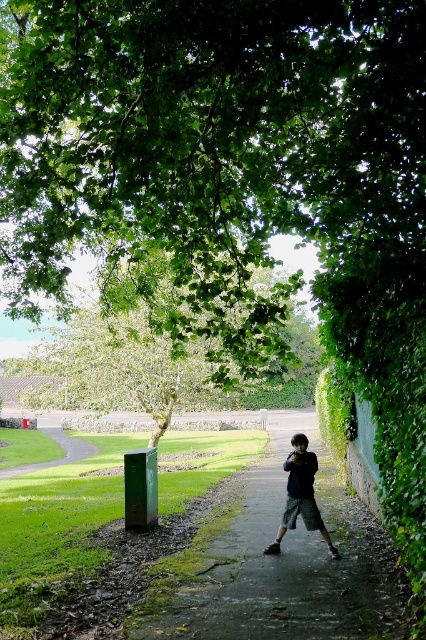
Question: Which point is closer to the camera?

Choices:
 (A) green leafy tree at upper center
 (B) dark green textured shorts at center

Answer: (A)

Question: Which point is farther from the camera taking this photo?

Choices:
 (A) (422, 140)
 (B) (330, 499)
 (C) (310, 461)

Answer: (B)

Question: Among these objects, which one is farthest from the camera?

Choices:
 (A) green leafy tree at upper center
 (B) smooth concrete pavement at center

Answer: (A)

Question: Is green leafy tree at upper center positioned at the back of dark green textured shorts at center?

Choices:
 (A) yes
 (B) no

Answer: (B)

Question: Can you confirm if green leafy tree at upper center is smaller than smooth concrete pavement at center?

Choices:
 (A) yes
 (B) no

Answer: (A)

Question: Considering the relative positions of smooth concrete pavement at center and dark green textured shorts at center in the image provided, where is smooth concrete pavement at center located with respect to dark green textured shorts at center?

Choices:
 (A) below
 (B) above

Answer: (A)